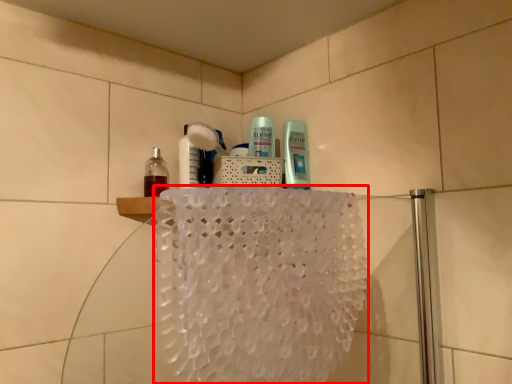
Question: From the image's perspective, what is the correct spatial positioning of bath towel (annotated by the red box) in reference to bottle?

Choices:
 (A) below
 (B) above

Answer: (A)